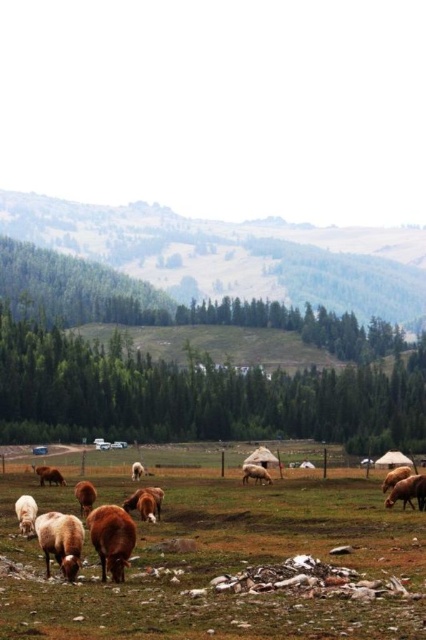
Consider the image. You are a shepherd trying to identify the smaller animal between the fuzzy brown sheep at lower left and the white woolly sheep at lower left. Which one should you approach first if you want to handle the smaller one?

The fuzzy brown sheep at lower left is smaller in size compared to the white woolly sheep at lower left, so you should approach the fuzzy brown sheep at lower left first.

You are a farmer checking the distance between your animals. You have two sheep, the fuzzy brown sheep at lower left and the white woolly sheep at lower left. You need to ensure they are at least 10 meters apart for safety. Based on the image, are they meeting the safety requirement?

The fuzzy brown sheep at lower left and white woolly sheep at lower left are 13.68 meters apart, which exceeds the required 10 meters, so they are meeting the safety requirement.